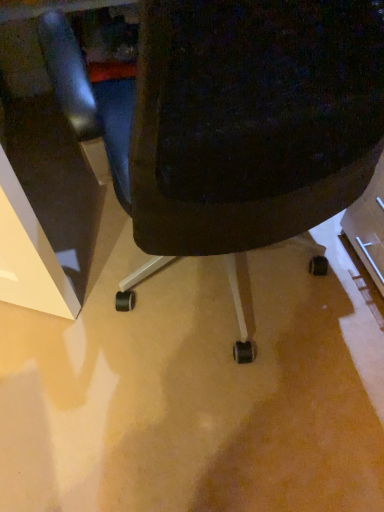
This screenshot has height=512, width=384. What are the coordinates of `black fabric chair at center` in the screenshot? It's located at (233, 117).

Describe the element at coordinates (233, 117) in the screenshot. Image resolution: width=384 pixels, height=512 pixels. I see `black fabric chair at center` at that location.

Locate an element on the screen. Image resolution: width=384 pixels, height=512 pixels. black fabric chair at center is located at coordinates (233, 117).